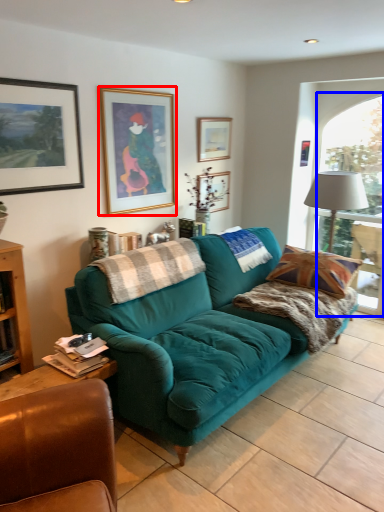
Question: Among these objects, which one is farthest to the camera, picture frame (highlighted by a red box) or window (highlighted by a blue box)?

Choices:
 (A) picture frame
 (B) window

Answer: (B)